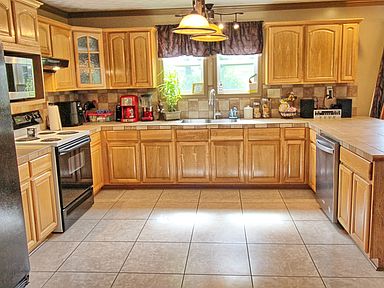
Identify the location of windows. The width and height of the screenshot is (384, 288). (236, 73), (189, 76).